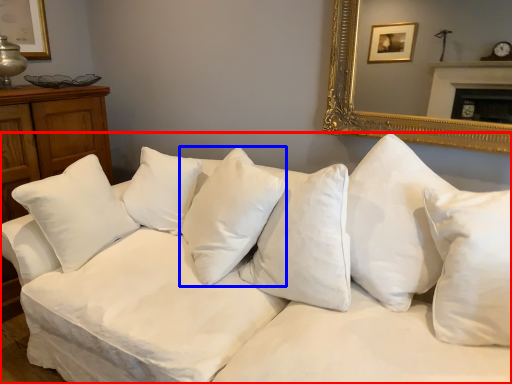
Question: Which object is further to the camera taking this photo, studio couch (highlighted by a red box) or pillow (highlighted by a blue box)?

Choices:
 (A) studio couch
 (B) pillow

Answer: (B)